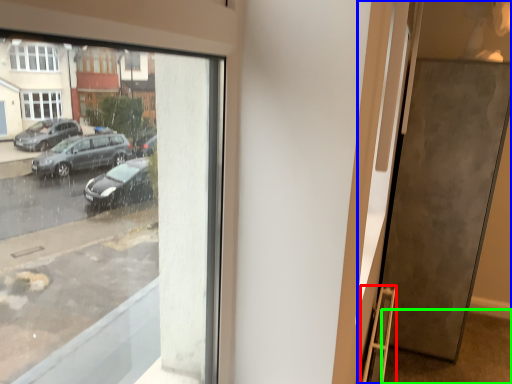
Question: Considering the real-world distances, which object is farthest from ladder (highlighted by a red box)? door (highlighted by a blue box) or pavement (highlighted by a green box)?

Choices:
 (A) door
 (B) pavement

Answer: (B)